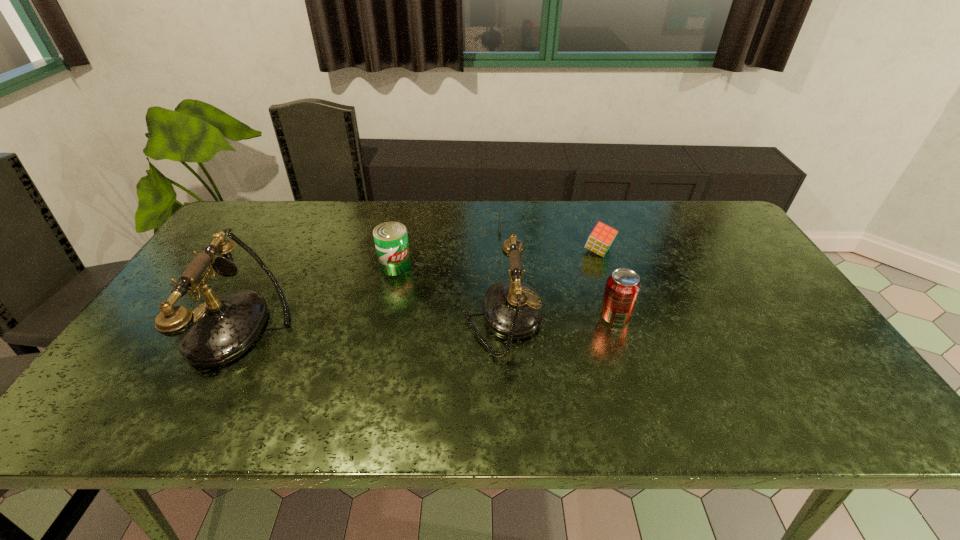
This screenshot has height=540, width=960. In order to click on the taller telephone in this screenshot , I will do `click(220, 330)`.

At what (x,y) coordinates should I click in order to perform the action: click on the tallest object. Please return your answer as a coordinate pair (x, y). Looking at the image, I should click on (220, 330).

This screenshot has width=960, height=540. I want to click on the second tallest object, so click(x=512, y=309).

Where is `the shorter telephone`? This screenshot has height=540, width=960. the shorter telephone is located at coordinates (512, 309).

Locate an element on the screen. This screenshot has height=540, width=960. the fifth tallest object is located at coordinates (599, 241).

Find the location of a particular element. The width and height of the screenshot is (960, 540). sunglasses is located at coordinates (512, 208).

The width and height of the screenshot is (960, 540). What are the coordinates of `the farthest object` in the screenshot? It's located at (512, 208).

Locate an element on the screen. soda can is located at coordinates (623, 286).

Where is `the fifth object from right to left`? the fifth object from right to left is located at coordinates (391, 239).

Where is `vacant space situated on the dial of the leftmost object`? vacant space situated on the dial of the leftmost object is located at coordinates (151, 325).